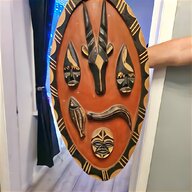
What are the coordinates of `floor` in the screenshot? It's located at (68, 173).